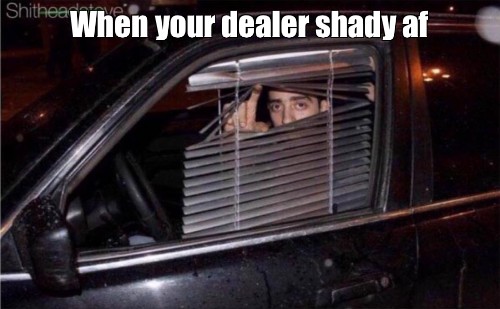
Locate an element on the screen. The width and height of the screenshot is (500, 309). orange lights off window is located at coordinates (446, 79), (436, 72).